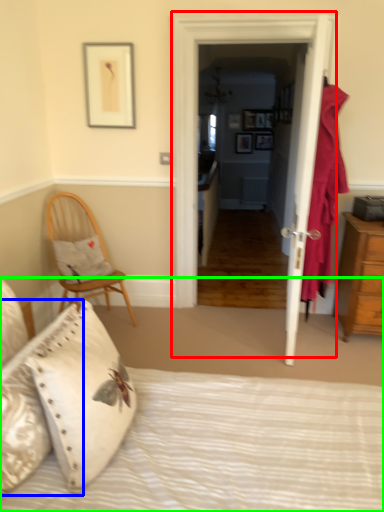
Question: Which object is the farthest from door (highlighted by a red box)? Choose among these: pillow (highlighted by a blue box) or bed (highlighted by a green box).

Choices:
 (A) pillow
 (B) bed

Answer: (A)